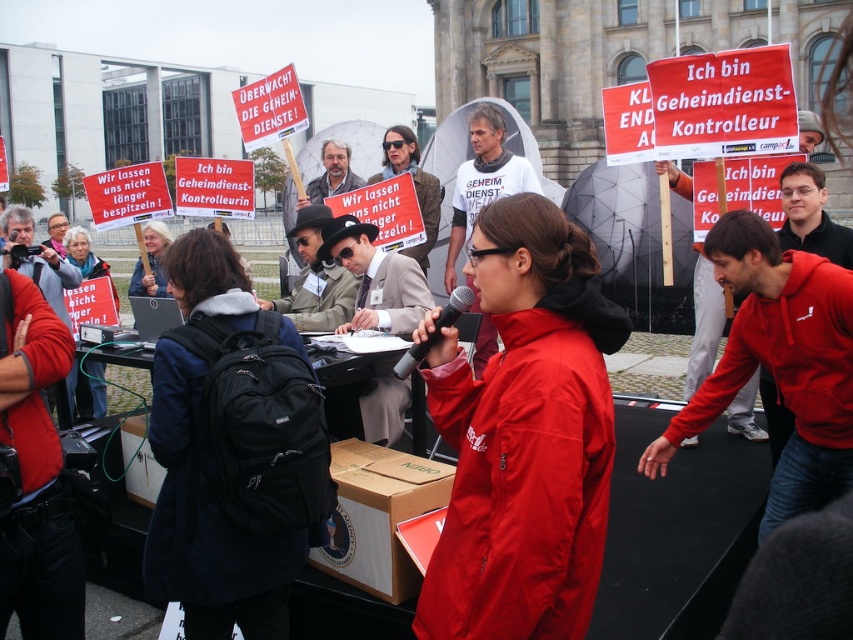
Question: Is red matte jacket at center above matte black jacket at center?

Choices:
 (A) no
 (B) yes

Answer: (A)

Question: Which of the following is the farthest from the observer?

Choices:
 (A) (612, 328)
 (B) (90, 243)
 (C) (187, 616)

Answer: (B)

Question: Which object appears closest to the camera in this image?

Choices:
 (A) matte black jacket at center
 (B) black fabric backpack at center
 (C) red matte jacket at center

Answer: (C)

Question: Can you confirm if red matte jacket at center is positioned to the left of black fabric backpack at center?

Choices:
 (A) no
 (B) yes

Answer: (A)

Question: Can you confirm if red matte jacket at center is smaller than matte black jacket at center?

Choices:
 (A) no
 (B) yes

Answer: (B)

Question: Estimate the real-world distances between objects in this image. Which object is farther from the black fabric backpack at center?

Choices:
 (A) red matte jacket at center
 (B) matte black jacket at center

Answer: (B)